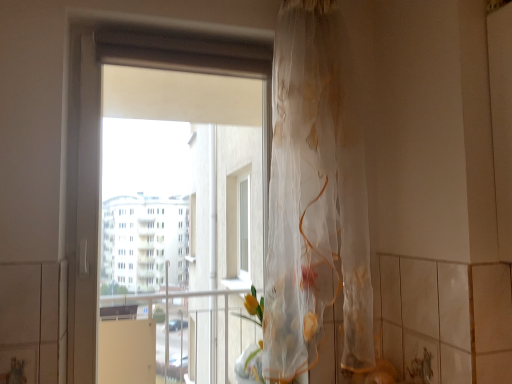
Question: Is translucent floral-patterned curtain at center in front of or behind transparent plastic window at center in the image?

Choices:
 (A) behind
 (B) front

Answer: (B)

Question: From a real-world perspective, is translucent floral-patterned curtain at center above or below transparent plastic window at center?

Choices:
 (A) below
 (B) above

Answer: (B)

Question: Is translucent floral-patterned curtain at center wider or thinner than transparent plastic window at center?

Choices:
 (A) thin
 (B) wide

Answer: (B)

Question: Considering the positions of point (75, 193) and point (335, 185), is point (75, 193) closer or farther from the camera than point (335, 185)?

Choices:
 (A) closer
 (B) farther

Answer: (B)

Question: Do you think transparent plastic window at center is within translucent floral-patterned curtain at center, or outside of it?

Choices:
 (A) outside
 (B) inside

Answer: (A)

Question: Is transparent plastic window at center in front of or behind translucent floral-patterned curtain at center in the image?

Choices:
 (A) front
 (B) behind

Answer: (B)

Question: From a real-world perspective, relative to translucent floral-patterned curtain at center, is transparent plastic window at center vertically above or below?

Choices:
 (A) below
 (B) above

Answer: (A)